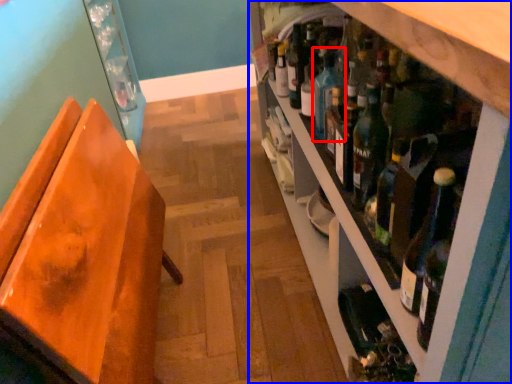
Question: Among these objects, which one is nearest to the camera, teal (highlighted by a red box) or shelf (highlighted by a blue box)?

Choices:
 (A) teal
 (B) shelf

Answer: (B)